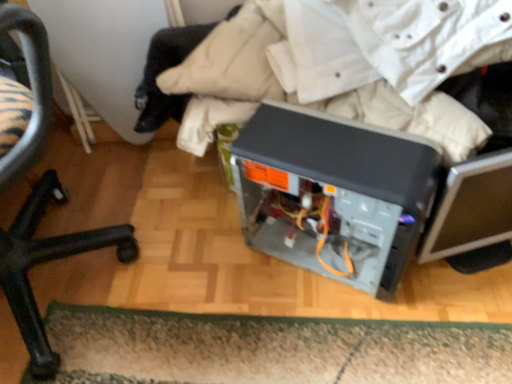
The width and height of the screenshot is (512, 384). Find the location of `free location above green shaggy doormat at lower center (from a real-world perspective)`. free location above green shaggy doormat at lower center (from a real-world perspective) is located at coordinates (265, 347).